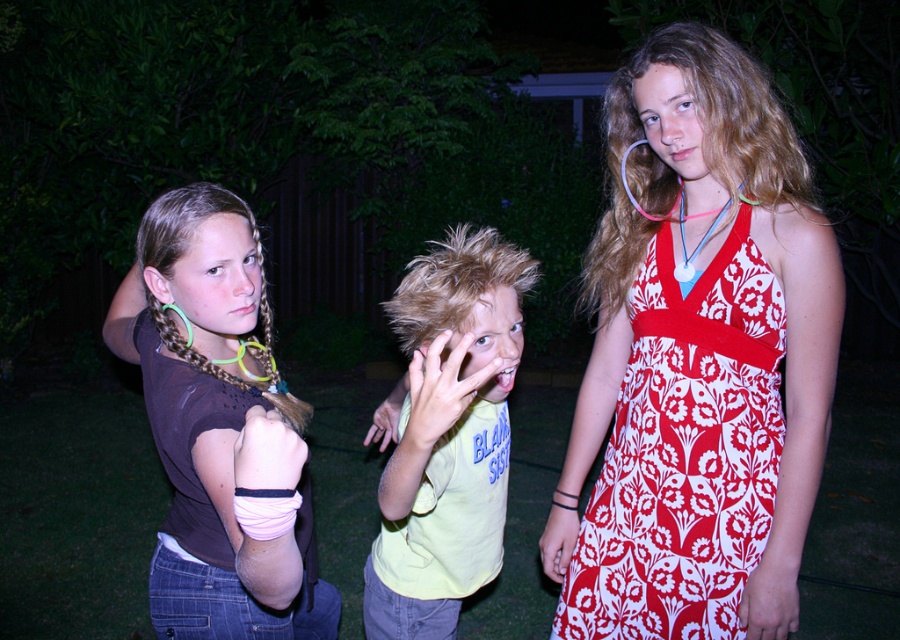
Question: Which object is closer to the camera taking this photo?

Choices:
 (A) red floral-patterned dress at upper right
 (B) brown matte shirt at center

Answer: (B)

Question: Which object is positioned closest to the brown matte shirt at center?

Choices:
 (A) yellow cotton shirt at center
 (B) red floral-patterned dress at upper right

Answer: (A)

Question: Observing the image, what is the correct spatial positioning of brown matte shirt at center in reference to yellow cotton shirt at center?

Choices:
 (A) below
 (B) above

Answer: (B)

Question: Does red floral-patterned dress at upper right lie in front of brown matte shirt at center?

Choices:
 (A) yes
 (B) no

Answer: (B)

Question: Can you confirm if brown matte shirt at center is bigger than yellow cotton shirt at center?

Choices:
 (A) no
 (B) yes

Answer: (B)

Question: Which is nearer to the red floral-patterned dress at upper right?

Choices:
 (A) brown matte shirt at center
 (B) yellow cotton shirt at center

Answer: (B)